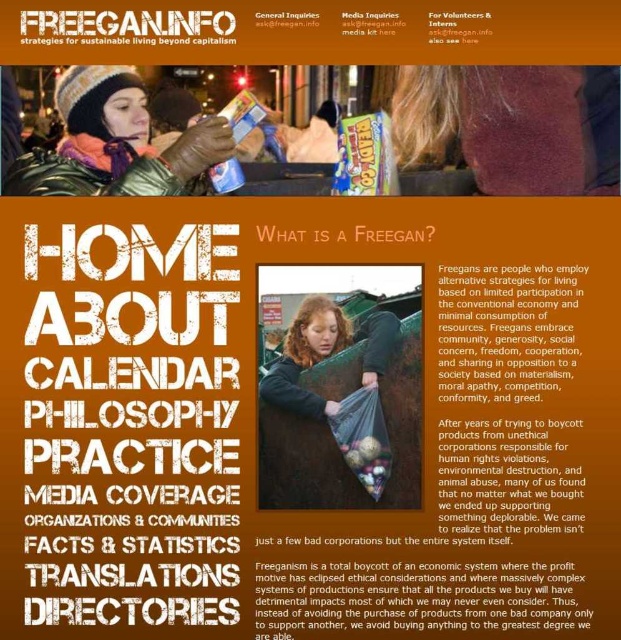
Which object is wider between the white paper text at center and the white paper media kit at upper center?

The white paper text at center is wider than the white paper media kit at upper center according to the description.